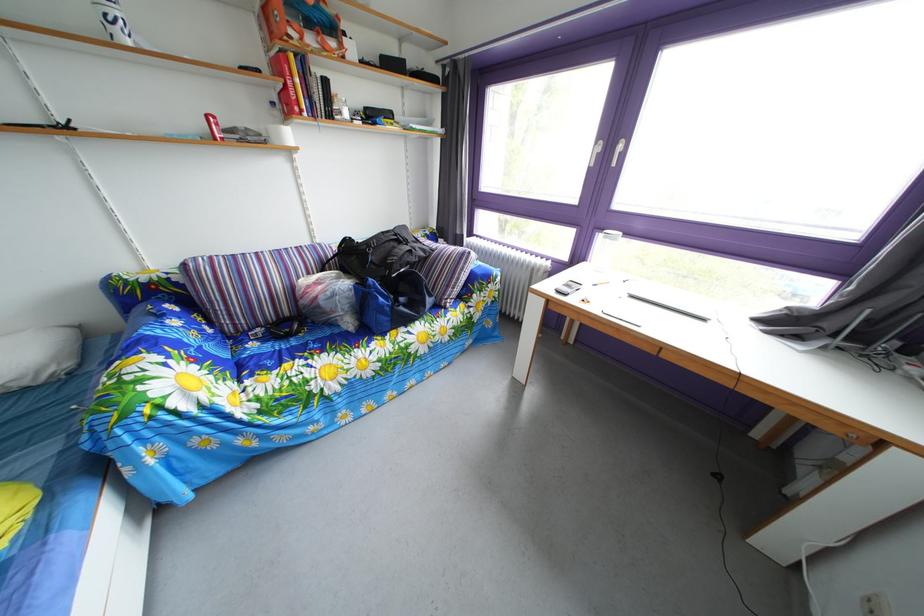
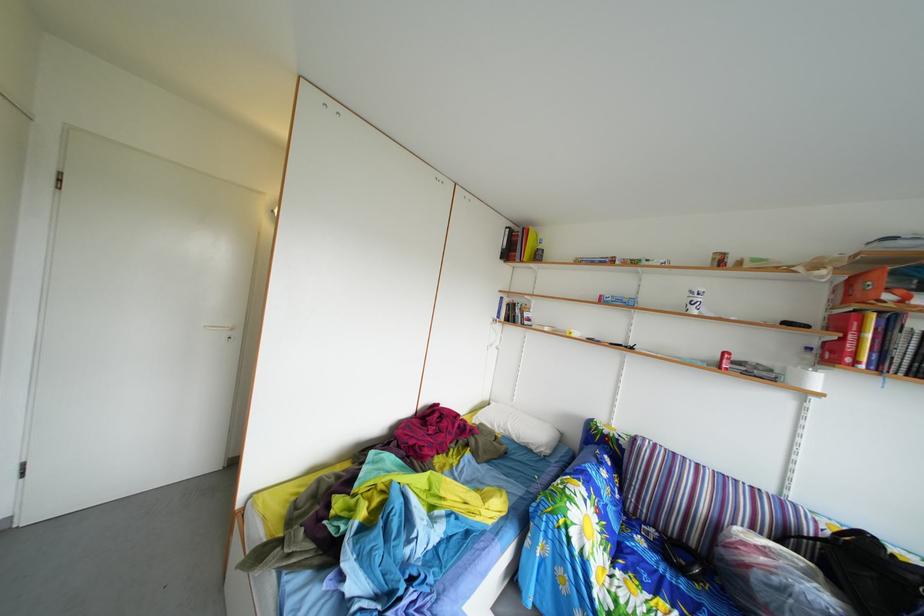
Question: The images are taken continuously from a first-person perspective. In which direction is your viewpoint rotating?

Choices:
 (A) Left
 (B) Right
 (C) Up
 (D) Down

Answer: (A)